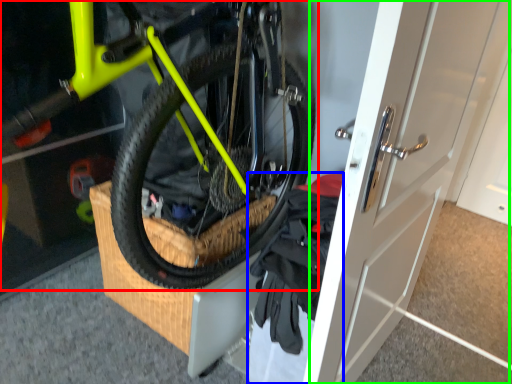
Question: Which object is positioned closest to bicycle (highlighted by a red box)? Select from clothing (highlighted by a blue box) and door (highlighted by a green box).

Choices:
 (A) clothing
 (B) door

Answer: (A)